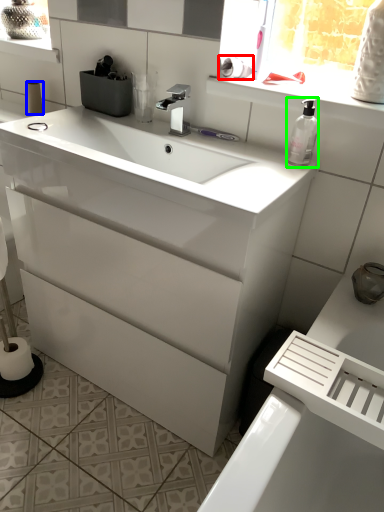
Question: Which object is positioned farthest from toilet paper (highlighted by a red box)? Select from toilet paper (highlighted by a blue box) and soap dispenser (highlighted by a green box).

Choices:
 (A) toilet paper
 (B) soap dispenser

Answer: (A)